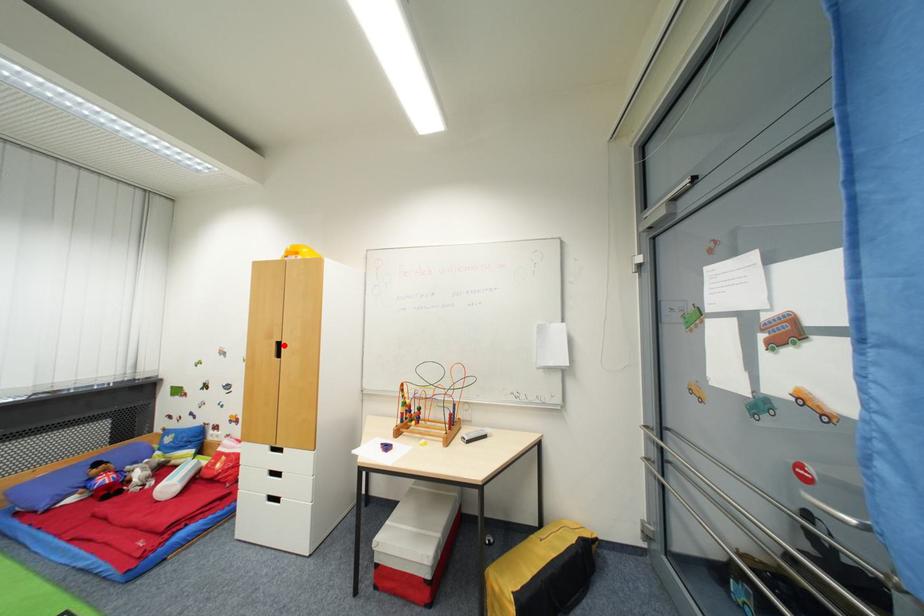
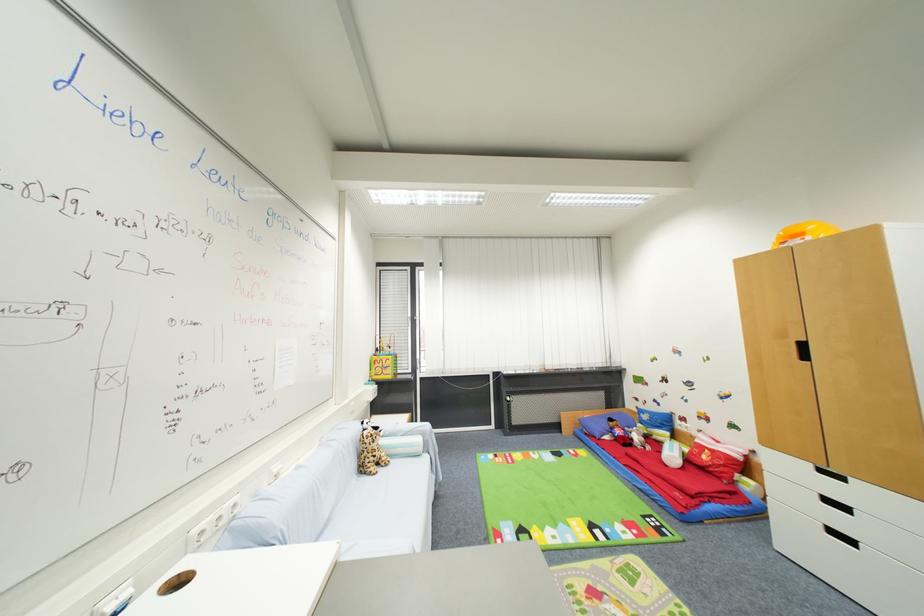
Where in the second image is the point corresponding to the highlighted location from the first image?

(808, 346)